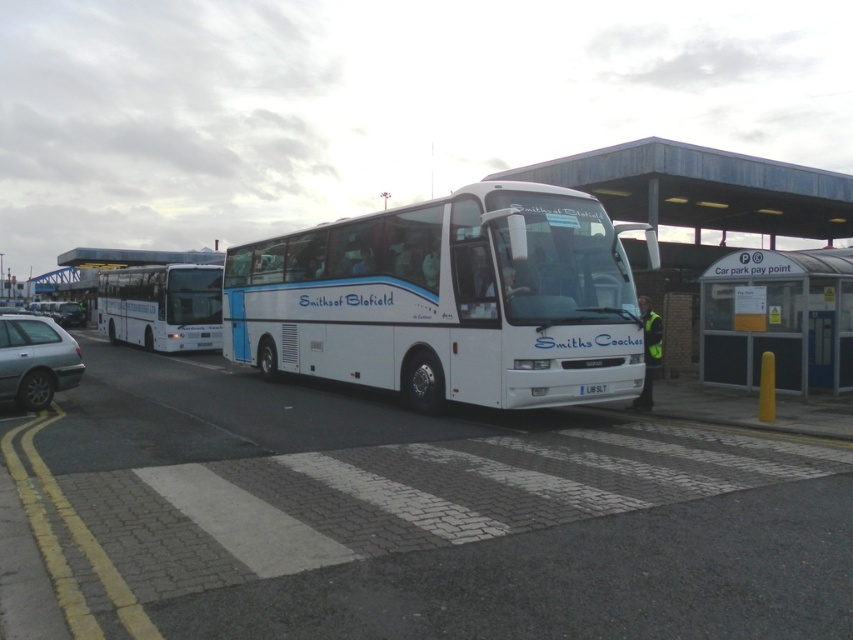
Can you confirm if white plastic bus at center is bigger than silver metallic hatchback at lower left?

Yes.

Can you confirm if white plastic bus at center is positioned to the right of silver metallic hatchback at lower left?

Yes, white plastic bus at center is to the right of silver metallic hatchback at lower left.

Based on the photo, who is more forward, (769, 230) or (15, 342)?

Point (15, 342)

What are the coordinates of `white plastic bus at center` in the screenshot? It's located at pos(698,204).

Who is lower down, white glossy coach at center or white plastic license plate at center?

Positioned lower is white plastic license plate at center.

Does white glossy coach at center lie in front of white plastic license plate at center?

Yes, it is.

The height and width of the screenshot is (640, 853). Find the location of `white glossy coach at center`. white glossy coach at center is located at coordinates (448, 300).

Is white matte bus at center to the left of white plastic license plate at center from the viewer's perspective?

Yes, white matte bus at center is to the left of white plastic license plate at center.

Is white matte bus at center shorter than white plastic license plate at center?

In fact, white matte bus at center may be taller than white plastic license plate at center.

Locate an element on the screen. This screenshot has height=640, width=853. white matte bus at center is located at coordinates (401, 516).